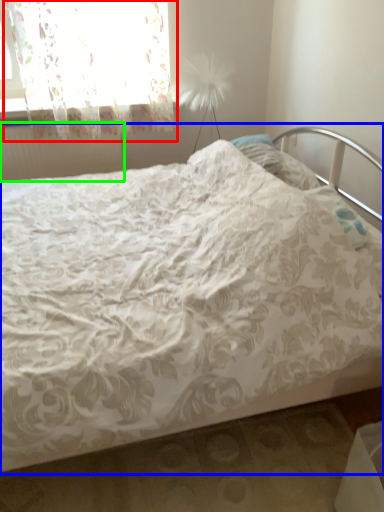
Question: Which object is the closest to the curtain (highlighted by a red box)? Choose among these: bed (highlighted by a blue box) or radiator (highlighted by a green box).

Choices:
 (A) bed
 (B) radiator

Answer: (B)